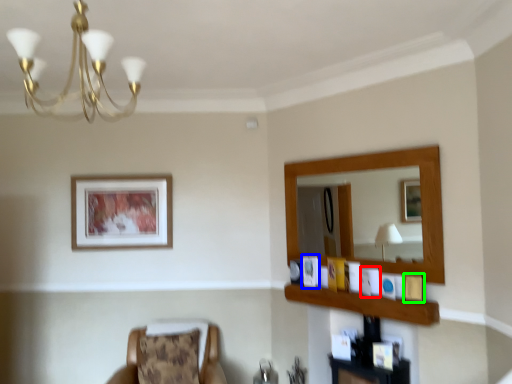
Question: Which object is positioned farthest from picture frame (highlighted by a red box)? Select from picture frame (highlighted by a blue box) and picture frame (highlighted by a green box).

Choices:
 (A) picture frame
 (B) picture frame

Answer: (A)